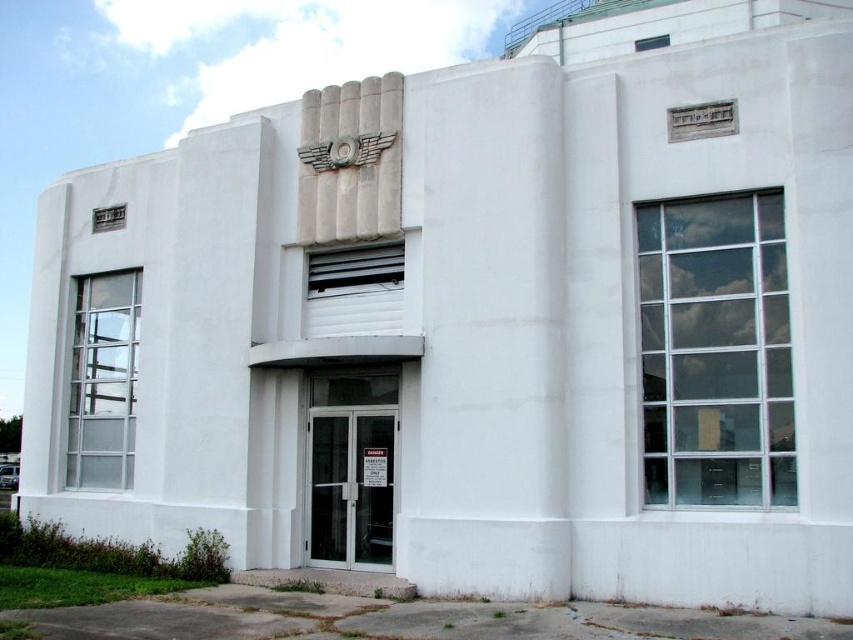
You are an architect evaluating the symmetry of the building. The building has a white smooth concrete pillar at center and a metallic silver clock at center. Which object takes up more space in the central area?

The metallic silver clock at center occupies more space than the white smooth concrete pillar at center in the central area.

You are standing at the entrance of the modernist building and want to check the time. There is a metallic silver clock at center and a white smooth concrete pillar at center. Which object is closer to you?

Both the white smooth concrete pillar at center and the metallic silver clock at center are at the same central location, so they are equally close to you.